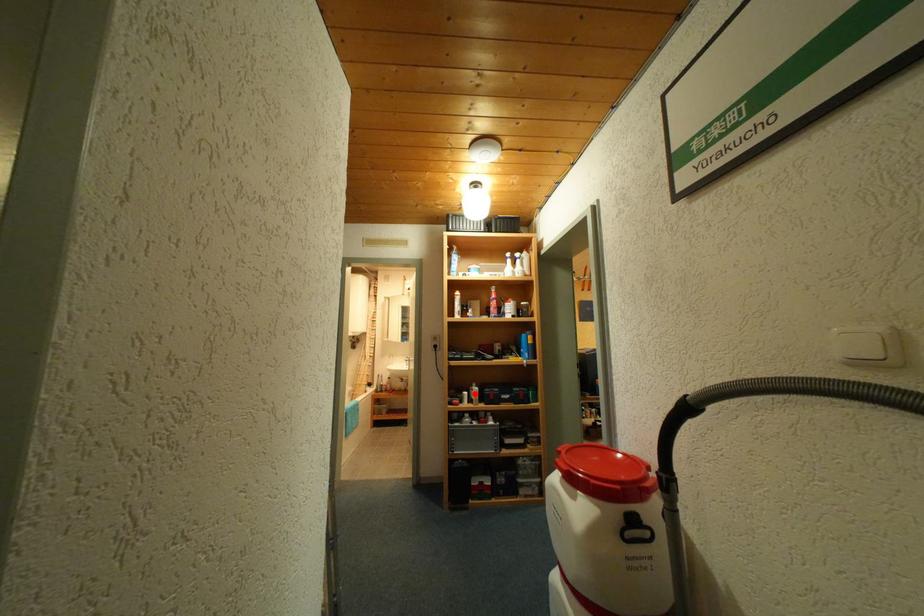
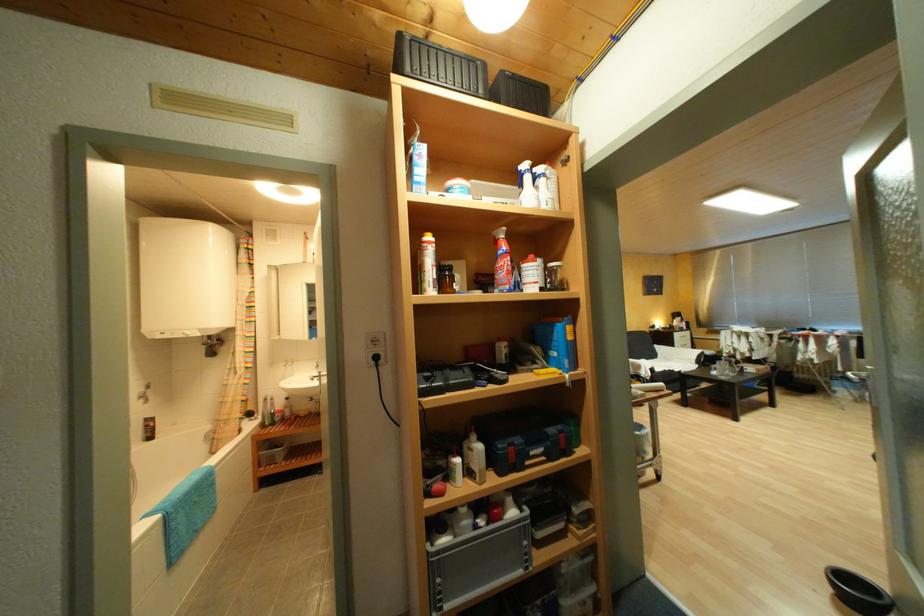
Find the pixel in the second image that matches the highlighted location in the first image.

(467, 461)